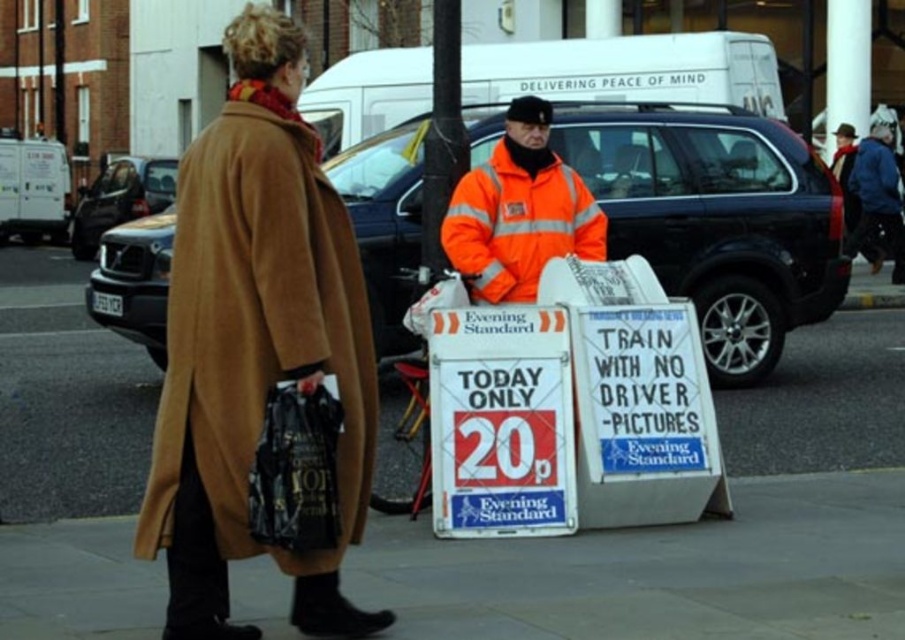
You are standing on the sidewalk and see the smooth concrete pavement at lower center and the tan woolen coat at left. Which object is located to the right of the other?

The smooth concrete pavement at lower center is to the right of tan woolen coat at left.